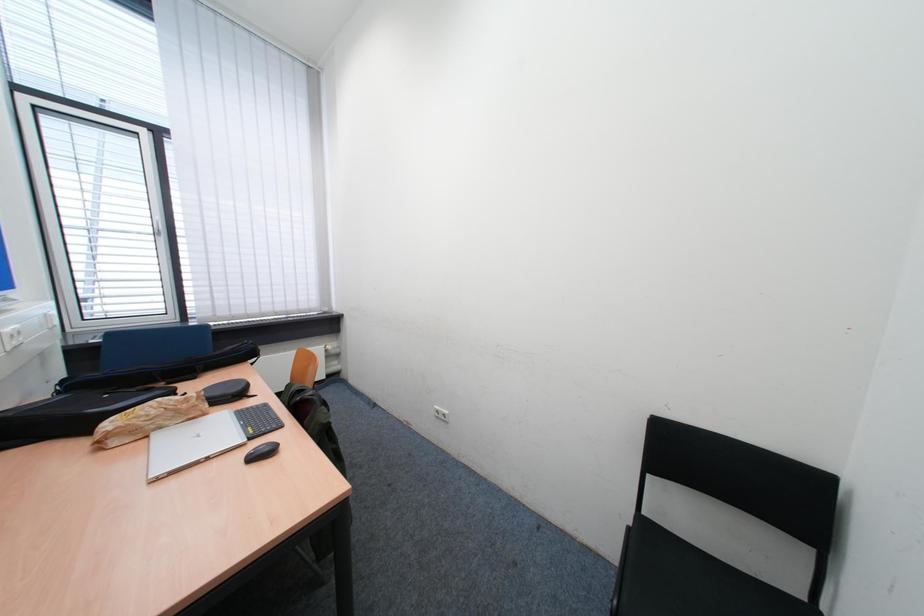
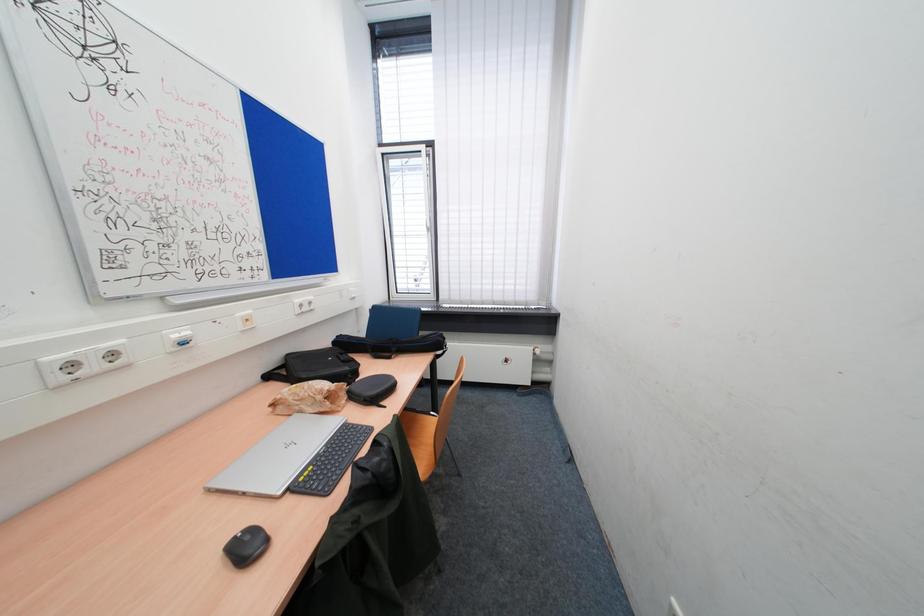
Question: Based on the continuous images, in which direction is the camera rotating? Reply with the corresponding letter.

Choices:
 (A) Left
 (B) Right
 (C) Up
 (D) Down

Answer: (A)